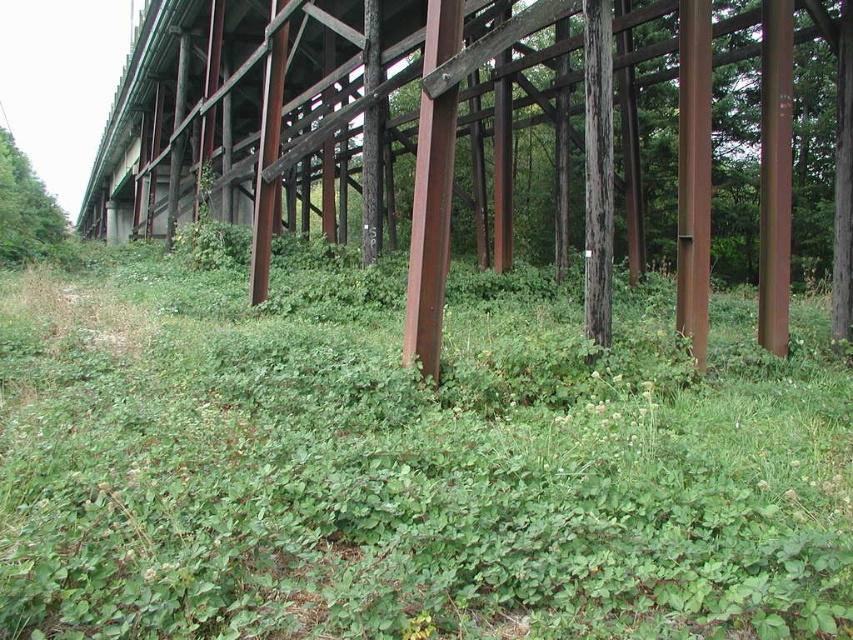
You are standing under the rusty metal bridge at center and want to walk to the green leafy grass at center. Is the grass directly under the bridge, or is it in another area?

The green leafy grass at center is located below the rusty metal bridge at center, so it is directly under the bridge.

You are a painter assigned to paint the rusty metal bridge at center and the green leafy tree at upper left. You need to know which one is wider so you can prepare the right amount of paint. Based on the scene, which object is wider?

The rusty metal bridge at center is wider than the green leafy tree at upper left according to the description.

You are standing at the base of the structure and want to take a photo of both point (780, 118) and point (28, 164). Which point will appear larger in your camera view?

Point (780, 118) is closer to the camera than point (28, 164), so it will appear larger in the camera view.